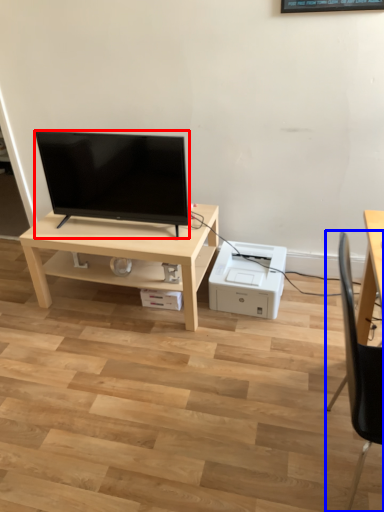
Question: Which of the following is the closest to the observer, television (highlighted by a red box) or chair (highlighted by a blue box)?

Choices:
 (A) television
 (B) chair

Answer: (B)